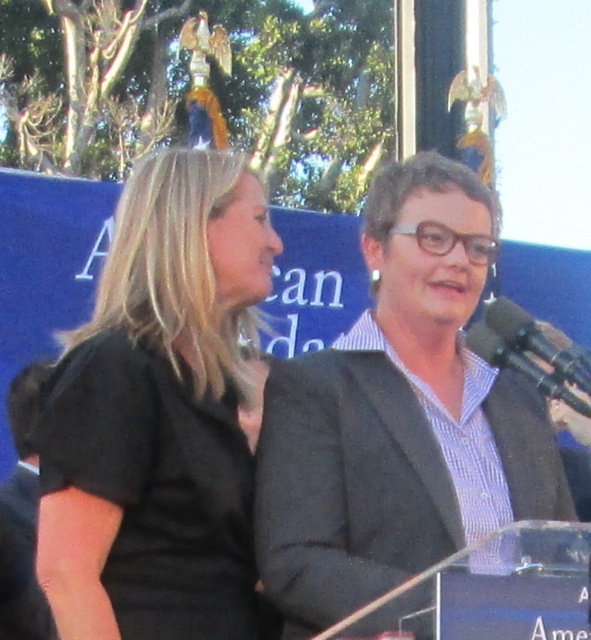
You are attending a formal event and want to take a photo of the speaker. The black matte shirt at center and the black plastic microphone at right are both in your view. Which object is closer to the camera?

The black matte shirt at center is in front of the black plastic microphone at right, so it is closer to the camera.

You are standing at the podium during a formal event and need to adjust the microphone. The microphone is located at point 0.5,0.5. Which direction should you move relative to the matte gray blazer at center to reach the microphone?

The microphone is located at point (295, 320), while the matte gray blazer at center is at point (400, 416). To reach the microphone, you should move northwest from the matte gray blazer at center.